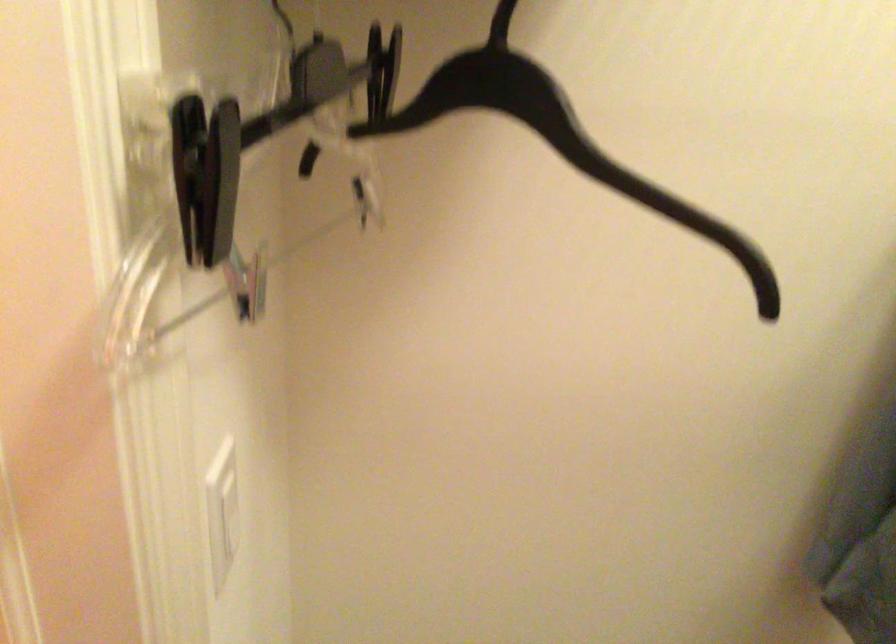
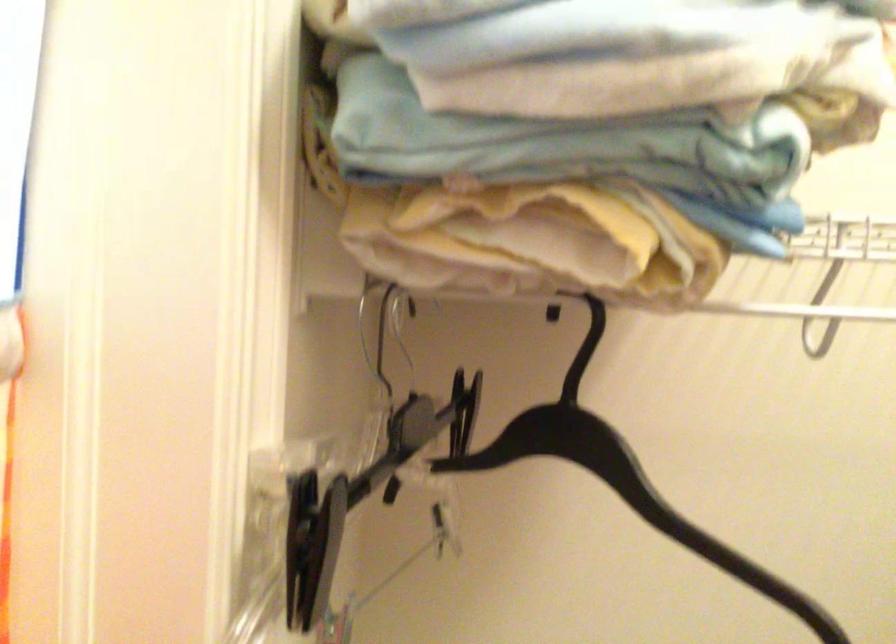
In the second image, find the point that corresponds to point 280,154 in the first image.

(362, 488)